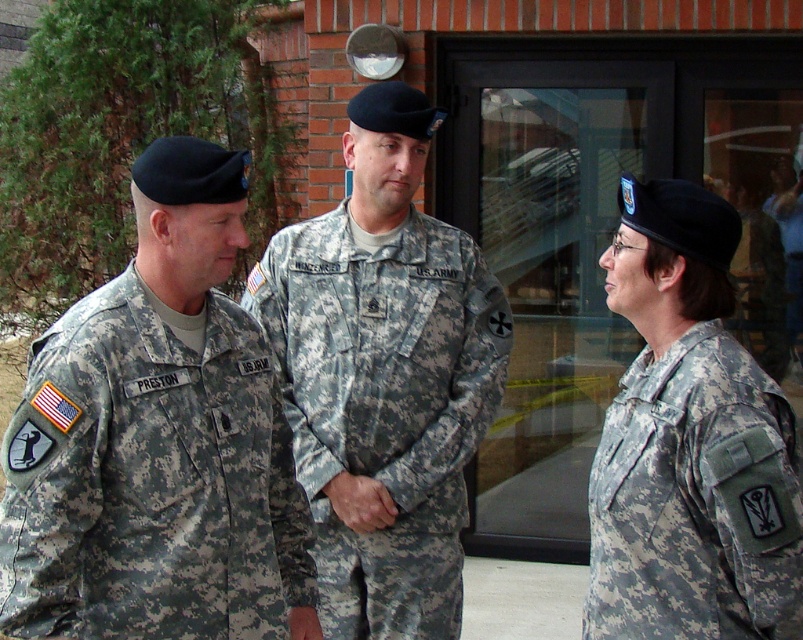
Question: Is camouflage uniform at center closer to camera compared to camouflage fabric uniform at right?

Choices:
 (A) yes
 (B) no

Answer: (B)

Question: Which of the following is the farthest from the observer?

Choices:
 (A) (58, 531)
 (B) (428, 346)

Answer: (B)

Question: Does camouflage uniform at center have a lesser width compared to camouflage fabric uniform at right?

Choices:
 (A) yes
 (B) no

Answer: (B)

Question: Is camouflage uniform at center behind camouflage fabric uniform at right?

Choices:
 (A) no
 (B) yes

Answer: (B)

Question: Which object is farther from the camera taking this photo?

Choices:
 (A) camouflage uniform at center
 (B) camouflage fabric uniform at right

Answer: (A)

Question: Based on their relative distances, which object is nearer to the camouflage fabric uniform at left?

Choices:
 (A) camouflage uniform at center
 (B) camouflage fabric uniform at right

Answer: (A)